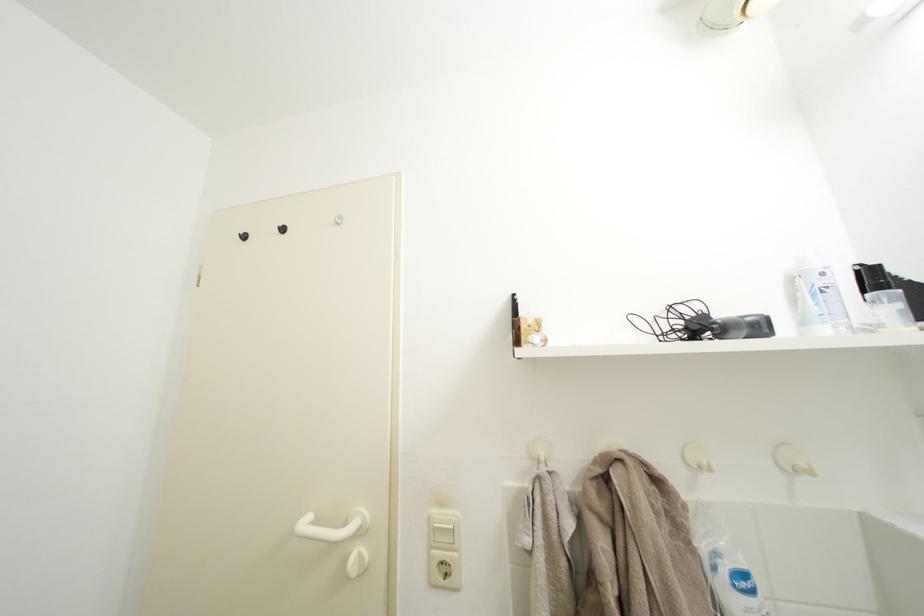
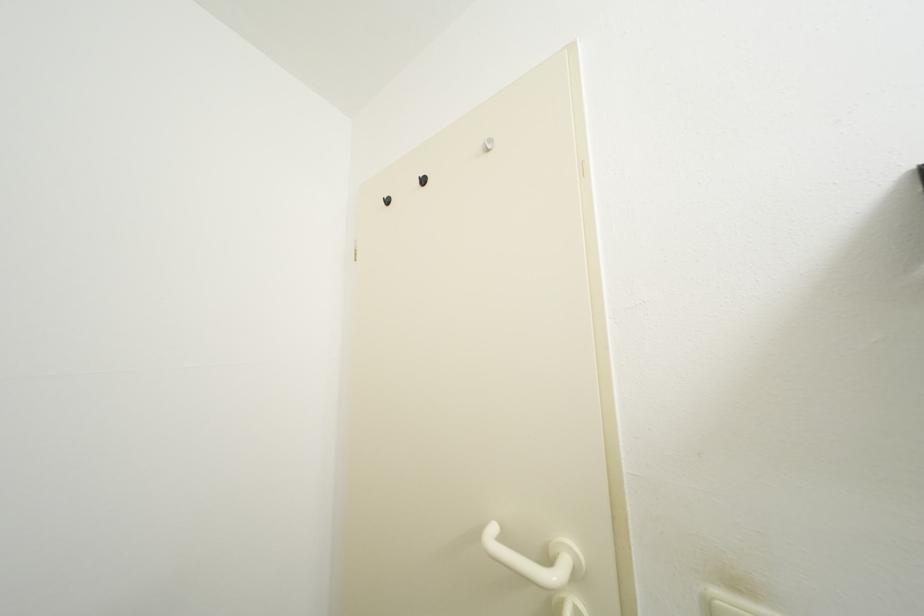
The images are taken continuously from a first-person perspective. In which direction are you moving?

The cameraman moved toward left, forward.